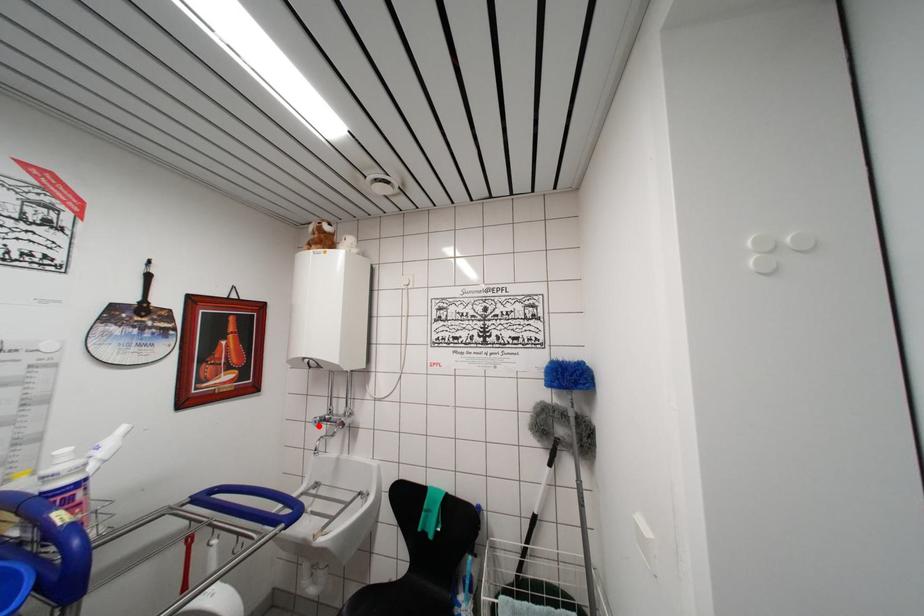
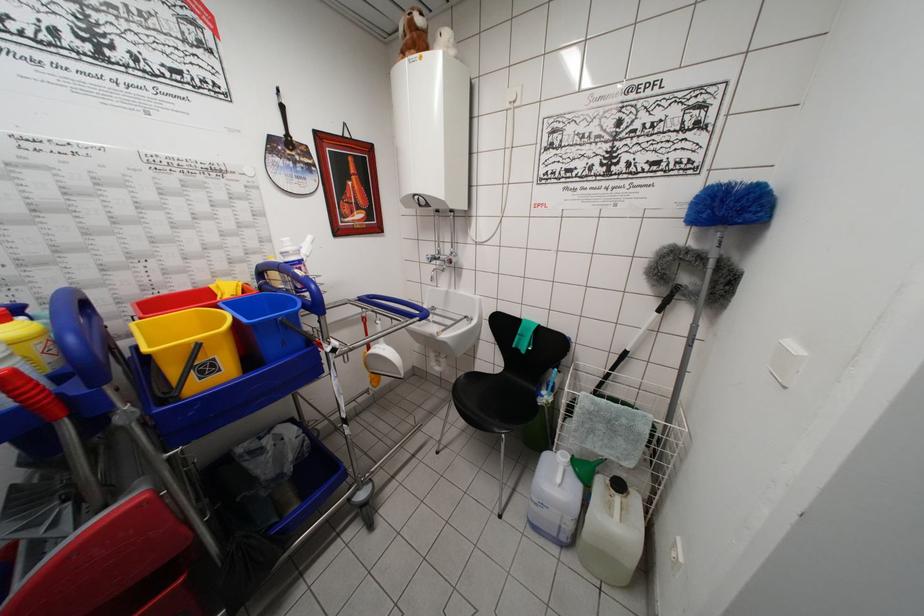
The point at the highlighted location is marked in the first image. Where is the corresponding point in the second image?

(432, 262)